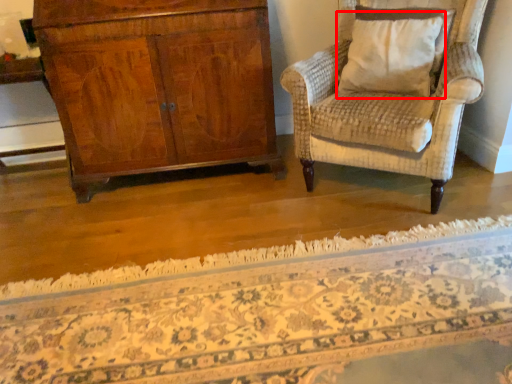
Question: From the image's perspective, what is the correct spatial relationship of pillow (annotated by the red box) in relation to mat?

Choices:
 (A) above
 (B) below

Answer: (A)